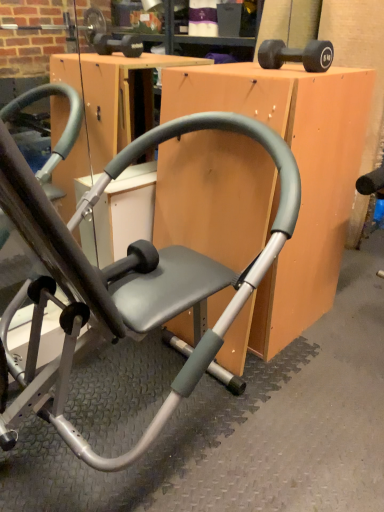
What do you see at coordinates (301, 183) in the screenshot? The height and width of the screenshot is (512, 384). I see `matte gray chair at center` at bounding box center [301, 183].

Find the location of a particular element. black rubber dumbbell at upper right is located at coordinates (296, 55).

Which is behind, point (246, 135) or point (322, 94)?

Point (322, 94)

Considering the relative sizes of matte gray chair at center and matte gray chair at center in the image provided, is matte gray chair at center smaller than matte gray chair at center?

Incorrect, matte gray chair at center is not smaller in size than matte gray chair at center.

From a real-world perspective, is matte gray chair at center under matte gray chair at center?

No, from a real-world perspective, matte gray chair at center is not below matte gray chair at center.

Would you say matte gray chair at center is part of matte gray chair at center's contents?

No, matte gray chair at center is not inside matte gray chair at center.

Is black rubber dumbbell at upper right further to camera compared to matte gray chair at center?

Yes, black rubber dumbbell at upper right is further from the camera.

At what (x,y) coordinates should I click in order to perform the action: click on table on the left of black rubber dumbbell at upper right. Please return your answer as a coordinate pair (x, y). This screenshot has height=512, width=384. Looking at the image, I should click on (301, 183).

From the image's perspective, which is above, black rubber dumbbell at upper right or matte gray chair at center?

From the image's view, black rubber dumbbell at upper right is above.

Between black rubber dumbbell at upper right and matte gray chair at center, which one has smaller size?

black rubber dumbbell at upper right.

Can black rubber dumbbell at upper right be found inside matte gray chair at center?

No.

In the image, there is a matte gray chair at center. At what (x,y) coordinates should I click in order to perform the action: click on dumbbell above it (from the image's perspective). Please return your answer as a coordinate pair (x, y). This screenshot has height=512, width=384. Looking at the image, I should click on [296, 55].

How different are the orientations of matte gray chair at center and black rubber dumbbell at upper right in degrees?

Result: They differ by 2.57 degrees in their facing directions.

Considering the sizes of objects matte gray chair at center and black rubber dumbbell at upper right in the image provided, who is shorter, matte gray chair at center or black rubber dumbbell at upper right?

black rubber dumbbell at upper right.

Considering the relative sizes of matte gray chair at center and black rubber dumbbell at upper right in the image provided, is matte gray chair at center smaller than black rubber dumbbell at upper right?

No, matte gray chair at center is not smaller than black rubber dumbbell at upper right.

Locate an element on the screen. table on the left side of black rubber dumbbell at upper right is located at coordinates (301, 183).

Choose the correct answer: Is matte gray chair at center inside black rubber dumbbell at upper right or outside it?

matte gray chair at center is outside black rubber dumbbell at upper right.

In terms of width, does matte gray chair at center look wider or thinner when compared to black rubber dumbbell at upper right?

Clearly, matte gray chair at center has more width compared to black rubber dumbbell at upper right.

I want to click on table located above the matte gray chair at center (from the image's perspective), so pos(301,183).

Considering the relative positions of matte gray chair at center and matte gray chair at center in the image provided, is matte gray chair at center to the left of matte gray chair at center from the viewer's perspective?

No, matte gray chair at center is not to the left of matte gray chair at center.

Considering the positions of points (268, 114) and (150, 267), is point (268, 114) closer to camera compared to point (150, 267)?

Yes, it is in front of point (150, 267).

Would you say matte gray chair at center is a long distance from matte gray chair at center?

matte gray chair at center is near matte gray chair at center, not far away.

Does black rubber dumbbell at upper right have a lesser width compared to matte gray chair at center?

Yes, black rubber dumbbell at upper right is thinner than matte gray chair at center.

Is black rubber dumbbell at upper right turned away from matte gray chair at center?

No, black rubber dumbbell at upper right is not facing the opposite direction of matte gray chair at center.

Is black rubber dumbbell at upper right further to camera compared to matte gray chair at center?

Yes, it is behind matte gray chair at center.

Is black rubber dumbbell at upper right completely or partially outside of matte gray chair at center?

Yes, black rubber dumbbell at upper right is located beyond the bounds of matte gray chair at center.

The height and width of the screenshot is (512, 384). What are the coordinates of `table on the right side of matte gray chair at center` in the screenshot? It's located at pos(301,183).

Image resolution: width=384 pixels, height=512 pixels. Identify the location of table that appears in front of the black rubber dumbbell at upper right. (301, 183).

From the image, which object appears to be farther from matte gray chair at center, matte gray chair at center or black rubber dumbbell at upper right?

Based on the image, black rubber dumbbell at upper right appears to be further to matte gray chair at center.

Considering their positions, is matte gray chair at center positioned closer to black rubber dumbbell at upper right than matte gray chair at center?

Among the two, matte gray chair at center is located nearer to black rubber dumbbell at upper right.

Considering their positions, is matte gray chair at center positioned further to black rubber dumbbell at upper right than matte gray chair at center?

matte gray chair at center lies further to black rubber dumbbell at upper right than the other object.

Estimate the real-world distances between objects in this image. Which object is closer to matte gray chair at center, black rubber dumbbell at upper right or matte gray chair at center?

Based on the image, matte gray chair at center appears to be nearer to matte gray chair at center.

Based on their spatial positions, is black rubber dumbbell at upper right or matte gray chair at center closer to matte gray chair at center?

matte gray chair at center is positioned closer to the anchor matte gray chair at center.

When comparing their distances from matte gray chair at center, does matte gray chair at center or black rubber dumbbell at upper right seem closer?

Based on the image, matte gray chair at center appears to be nearer to matte gray chair at center.

At what (x,y) coordinates should I click in order to perform the action: click on table positioned between matte gray chair at center and black rubber dumbbell at upper right from near to far. Please return your answer as a coordinate pair (x, y). Looking at the image, I should click on (301, 183).